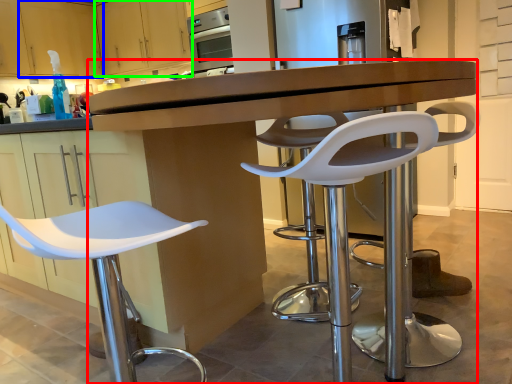
Question: Considering the real-world distances, which object is farthest from desk (highlighted by a red box)? cabinetry (highlighted by a blue box) or cabinetry (highlighted by a green box)?

Choices:
 (A) cabinetry
 (B) cabinetry

Answer: (A)